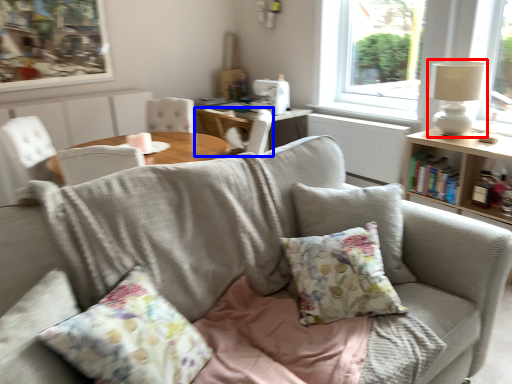
Question: Which point is closer to the camera, table lamp (highlighted by a red box) or chair (highlighted by a blue box)?

Choices:
 (A) table lamp
 (B) chair

Answer: (A)